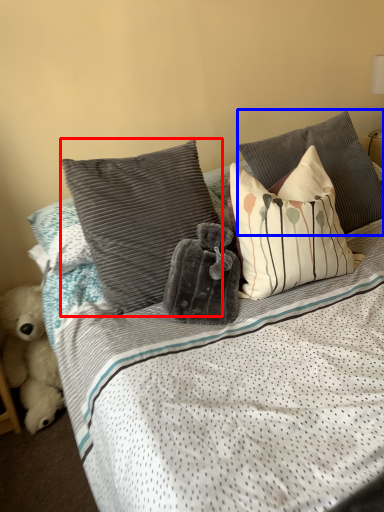
Question: Which of the following is the closest to the observer, pillow (highlighted by a red box) or pillow (highlighted by a blue box)?

Choices:
 (A) pillow
 (B) pillow

Answer: (A)